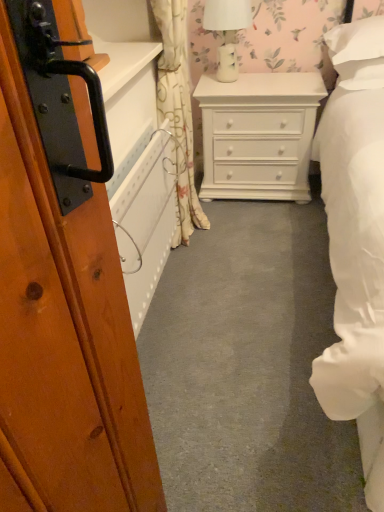
You are a GUI agent. You are given a task and a screenshot of the screen. Output one action in this format:
    pyautogui.click(x=<x>, y=<y>)
    Task: Click on the free space in front of white glossy table lamp at upper center
    
    Given the screenshot: What is the action you would take?
    pyautogui.click(x=249, y=88)